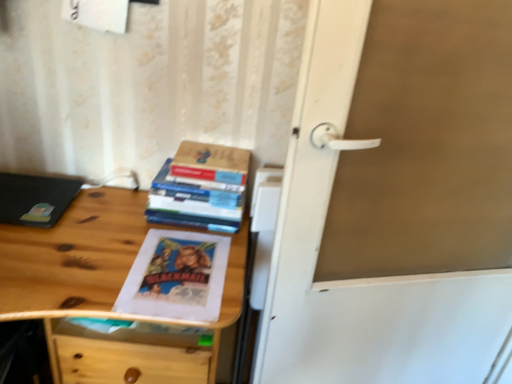
Locate an element on the screen. free location to the right of matte black laptop at left is located at coordinates (97, 226).